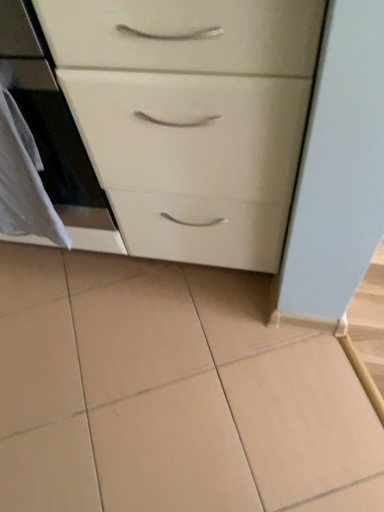
Identify the location of white fabric at left. This screenshot has height=512, width=384. (24, 181).

You are a GUI agent. You are given a task and a screenshot of the screen. Output one action in this format:
    pyautogui.click(x=<x>, y=<y>)
    Task: Click on the white glossy oven at left
    This screenshot has width=384, height=512.
    Given the screenshot: What is the action you would take?
    coord(54,131)

Describe the element at coordinates (54, 131) in the screenshot. I see `white glossy oven at left` at that location.

The height and width of the screenshot is (512, 384). Identify the location of white fabric at left. (24, 181).

Is white fabric at left far away from white glossy chest of drawers at center?

white fabric at left is near white glossy chest of drawers at center, not far away.

Is point (18, 185) positioned after point (81, 42)?

Yes.

From the image's perspective, which object appears higher, white fabric at left or white glossy chest of drawers at center?

white glossy chest of drawers at center, from the image's perspective.

From a real-world perspective, between white glossy chest of drawers at center and white fabric at left, who is vertically lower?

From a 3D spatial view, white glossy chest of drawers at center is below.

From the image's perspective, would you say white glossy chest of drawers at center is positioned over white fabric at left?

Yes, from the image's perspective, white glossy chest of drawers at center is above white fabric at left.

Considering the sizes of objects white glossy chest of drawers at center and white fabric at left in the image provided, who is wider, white glossy chest of drawers at center or white fabric at left?

white glossy chest of drawers at center is wider.

Between white glossy chest of drawers at center and white fabric at left, which one has more height?

Standing taller between the two is white glossy chest of drawers at center.

Is white glossy chest of drawers at center bigger or smaller than white glossy oven at left?

Clearly, white glossy chest of drawers at center is larger in size than white glossy oven at left.

Based on the photo, considering the sizes of white glossy chest of drawers at center and white glossy oven at left in the image, is white glossy chest of drawers at center taller or shorter than white glossy oven at left?

Clearly, white glossy chest of drawers at center is taller compared to white glossy oven at left.

From a real-world perspective, is white glossy chest of drawers at center positioned under white glossy oven at left based on gravity?

Yes.

At what (x,y) coordinates should I click in order to perform the action: click on the chest of drawers located underneath the white glossy oven at left (from a real-world perspective). Please return your answer as a coordinate pair (x, y). Image resolution: width=384 pixels, height=512 pixels. Looking at the image, I should click on (233, 134).

How many degrees apart are the facing directions of white glossy oven at left and white fabric at left?

They differ by 1.25 degrees in their facing directions.

Based on the photo, is white fabric at left at the back of white glossy oven at left?

No, white fabric at left is not at the back of white glossy oven at left.

Which object is thinner, white glossy oven at left or white fabric at left?

white fabric at left.

From the image's perspective, relative to white fabric at left, is white glossy oven at left above or below?

Clearly, from the image's perspective, white glossy oven at left is above white fabric at left.

Considering the positions of objects white glossy oven at left and white glossy chest of drawers at center in the image provided, who is more to the right, white glossy oven at left or white glossy chest of drawers at center?

white glossy chest of drawers at center.

From a real-world perspective, which is physically above, white glossy oven at left or white glossy chest of drawers at center?

In real-world perspective, white glossy oven at left is above.

Does white fabric at left appear on the left side of white glossy oven at left?

Incorrect, white fabric at left is not on the left side of white glossy oven at left.

Between white fabric at left and white glossy oven at left, which one is positioned behind?

white fabric at left is more distant.

How many degrees apart are the facing directions of white fabric at left and white glossy oven at left?

The facing directions of white fabric at left and white glossy oven at left are 1.25 degrees apart.

At what (x,y) coordinates should I click in order to perform the action: click on material behind the white glossy chest of drawers at center. Please return your answer as a coordinate pair (x, y). Looking at the image, I should click on (24, 181).

This screenshot has width=384, height=512. There is a white glossy chest of drawers at center. In order to click on material above it (from a real-world perspective) in this screenshot , I will do `click(24, 181)`.

Based on their spatial positions, is white glossy oven at left or white fabric at left closer to white glossy chest of drawers at center?

white glossy oven at left is positioned closer to the anchor white glossy chest of drawers at center.

Considering their positions, is white glossy chest of drawers at center positioned further to white glossy oven at left than white fabric at left?

white glossy chest of drawers at center is further to white glossy oven at left.

Which object lies further to the anchor point white fabric at left, white glossy oven at left or white glossy chest of drawers at center?

white glossy chest of drawers at center is positioned further to the anchor white fabric at left.

Estimate the real-world distances between objects in this image. Which object is closer to white fabric at left, white glossy chest of drawers at center or white glossy oven at left?

white glossy oven at left is closer to white fabric at left.

Estimate the real-world distances between objects in this image. Which object is closer to white glossy oven at left, white fabric at left or white glossy chest of drawers at center?

The object closer to white glossy oven at left is white fabric at left.

When comparing their distances from white glossy chest of drawers at center, does white fabric at left or white glossy oven at left seem further?

white fabric at left is positioned further to the anchor white glossy chest of drawers at center.

You are a GUI agent. You are given a task and a screenshot of the screen. Output one action in this format:
    pyautogui.click(x=<x>, y=<y>)
    Task: Click on the chest of drawers between white glossy oven at left and white fabric at left in the up-down direction
    
    Given the screenshot: What is the action you would take?
    pyautogui.click(x=233, y=134)